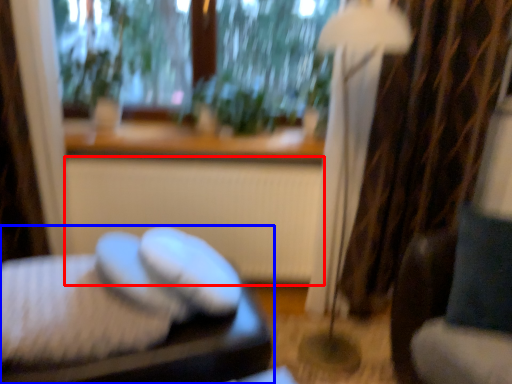
Question: Which point is further to the camera, radiator (highlighted by a red box) or furniture (highlighted by a blue box)?

Choices:
 (A) radiator
 (B) furniture

Answer: (A)